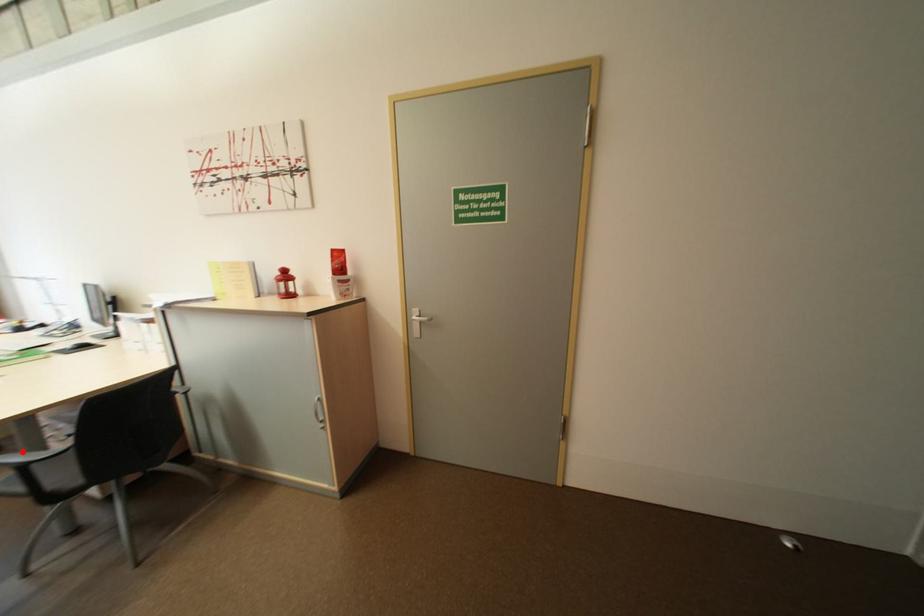
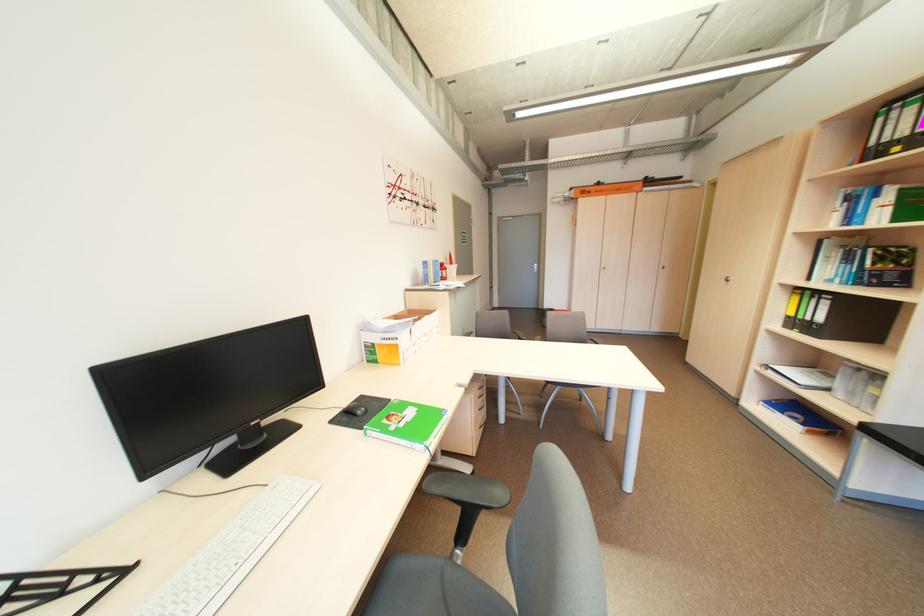
Question: I am providing you with two images of the same scene from different viewpoints. A red point is marked on the first image. Is the red point's position out of view in image 2?

Choices:
 (A) Yes
 (B) No

Answer: (A)